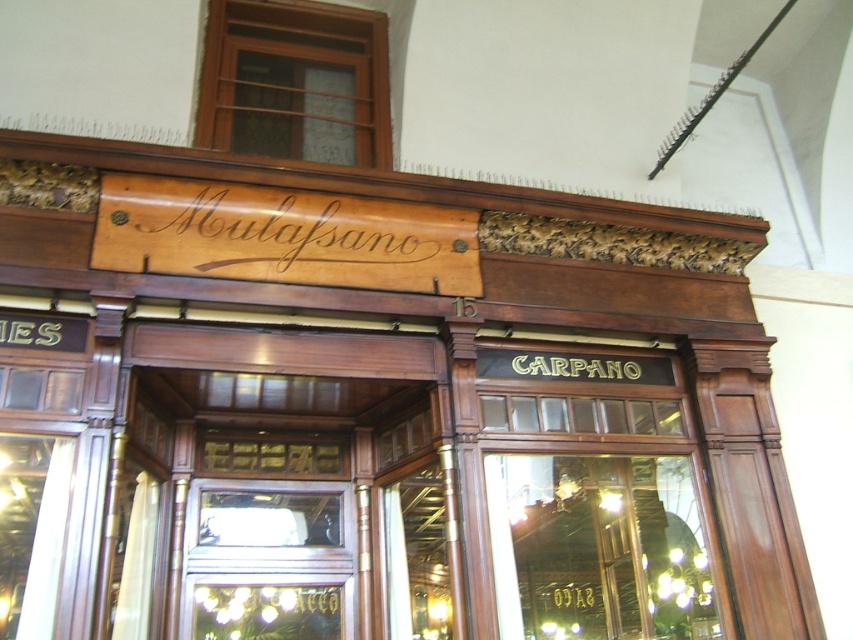
Question: Can you confirm if transparent glass door at center is positioned above wooden sign at center?

Choices:
 (A) yes
 (B) no

Answer: (B)

Question: Where is transparent glass door at center located in relation to wooden sign at center in the image?

Choices:
 (A) right
 (B) left

Answer: (A)

Question: Does transparent glass door at center appear over wooden sign at center?

Choices:
 (A) yes
 (B) no

Answer: (B)

Question: Which point is farther to the camera?

Choices:
 (A) wooden sign at center
 (B) transparent glass door at center

Answer: (A)